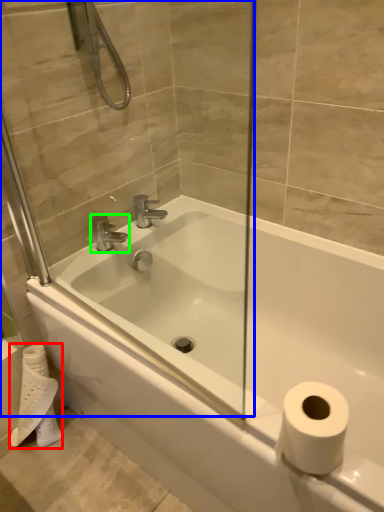
Question: Estimate the real-world distances between objects in this image. Which object is farther from toilet paper (highlighted by a red box), glass door (highlighted by a blue box) or tap (highlighted by a green box)?

Choices:
 (A) glass door
 (B) tap

Answer: (A)